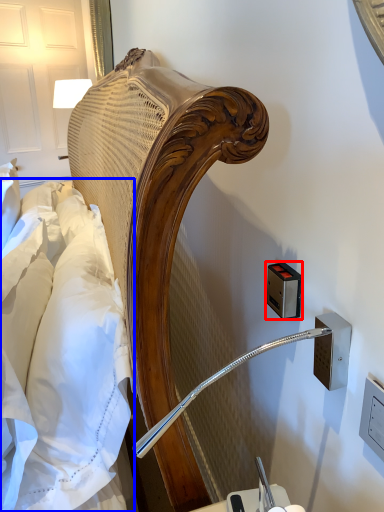
Question: Which point is further to the camera, electric outlet (highlighted by a red box) or sheet (highlighted by a blue box)?

Choices:
 (A) electric outlet
 (B) sheet

Answer: (A)